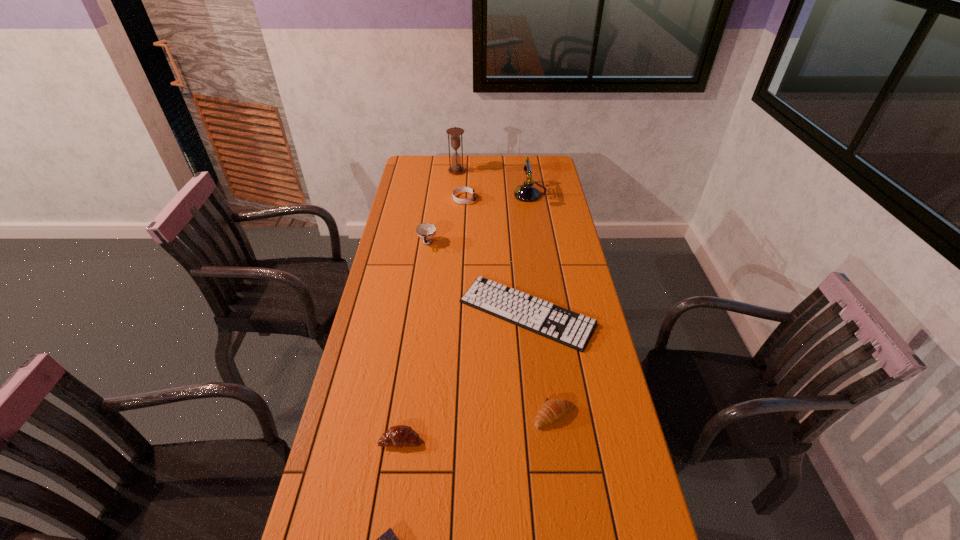
You are a GUI agent. You are given a task and a screenshot of the screen. Output one action in this format:
    pyautogui.click(x=<x>, y=<y>)
    Task: Click on the farthest object
    
    Given the screenshot: What is the action you would take?
    pyautogui.click(x=455, y=132)

This screenshot has height=540, width=960. Find the location of `the tallest object`. the tallest object is located at coordinates (455, 132).

Image resolution: width=960 pixels, height=540 pixels. What are the coordinates of `the seventh shortest object` in the screenshot? It's located at (527, 192).

The width and height of the screenshot is (960, 540). In order to click on the sixth shortest object in this screenshot , I will do `click(427, 231)`.

Find the location of a particular element. cup is located at coordinates (427, 231).

Where is `wristband`? The width and height of the screenshot is (960, 540). wristband is located at coordinates (460, 189).

Image resolution: width=960 pixels, height=540 pixels. I want to click on the right crescent roll, so click(552, 409).

This screenshot has height=540, width=960. In order to click on the left crescent roll in this screenshot , I will do `click(397, 436)`.

You are a GUI agent. You are given a task and a screenshot of the screen. Output one action in this format:
    pyautogui.click(x=<x>, y=<y>)
    Task: Click on the computer keyboard
    The height and width of the screenshot is (540, 960).
    Given the screenshot: What is the action you would take?
    pyautogui.click(x=556, y=323)

At what (x,y) coordinates should I click in order to perform the action: click on free point located on the right of the tallest object. Please return your answer as a coordinate pair (x, y). This screenshot has width=960, height=540. Looking at the image, I should click on 533,171.